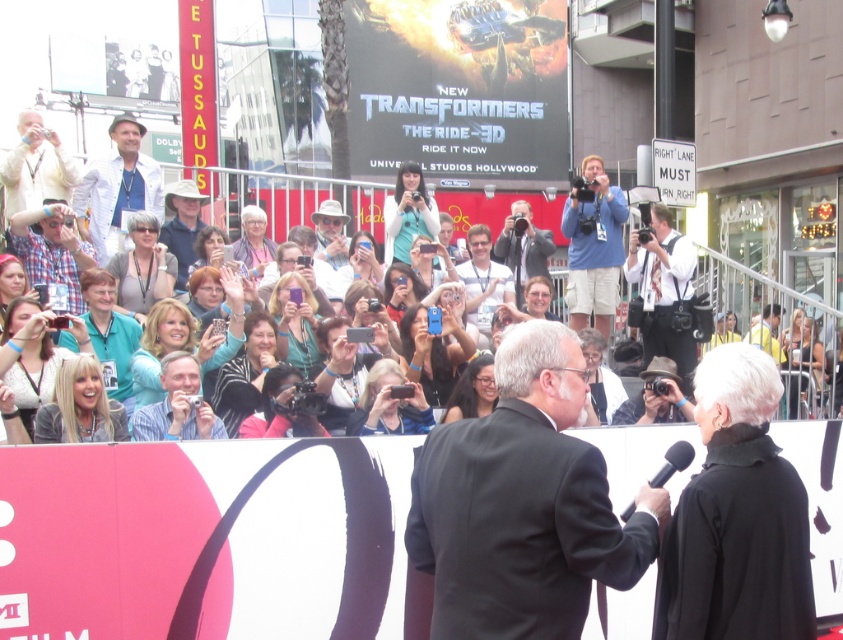
Question: Is white matte shirt at upper center thinner than striped shirt at center?

Choices:
 (A) yes
 (B) no

Answer: (B)

Question: Which of the following is the farthest from the observer?

Choices:
 (A) light beige fabric hat at upper left
 (B) black suit at center
 (C) khaki fabric hat at center

Answer: (C)

Question: Which point is farther from the camera taking this photo?

Choices:
 (A) (133, 209)
 (B) (503, 259)
 (C) (47, 205)
 (D) (643, 273)

Answer: (B)

Question: Is brown leather camera at right behind light beige fabric hat at upper left?

Choices:
 (A) no
 (B) yes

Answer: (B)

Question: Which point appears closest to the camera in this image?

Choices:
 (A) (516, 349)
 (B) (168, 195)
 (C) (74, 264)

Answer: (A)

Question: Does brown leather camera at right have a smaller size compared to light beige fabric hat at upper left?

Choices:
 (A) yes
 (B) no

Answer: (B)